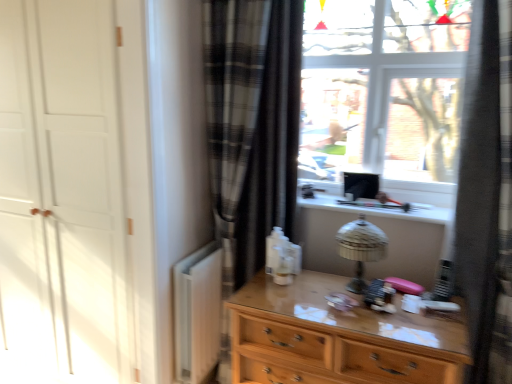
Question: From the image's perspective, is plaid fabric curtain at center on top of wooden chest of drawers at center?

Choices:
 (A) no
 (B) yes

Answer: (B)

Question: Does plaid fabric curtain at center have a lesser width compared to wooden chest of drawers at center?

Choices:
 (A) no
 (B) yes

Answer: (B)

Question: Is plaid fabric curtain at center smaller than wooden chest of drawers at center?

Choices:
 (A) no
 (B) yes

Answer: (B)

Question: From the image's perspective, would you say plaid fabric curtain at center is shown under wooden chest of drawers at center?

Choices:
 (A) no
 (B) yes

Answer: (A)

Question: Does plaid fabric curtain at center contain wooden chest of drawers at center?

Choices:
 (A) no
 (B) yes

Answer: (A)

Question: Can you confirm if plaid fabric curtain at center is taller than wooden chest of drawers at center?

Choices:
 (A) yes
 (B) no

Answer: (A)

Question: Considering the relative sizes of metallic silver table lamp at center and wooden chest of drawers at center in the image provided, is metallic silver table lamp at center bigger than wooden chest of drawers at center?

Choices:
 (A) no
 (B) yes

Answer: (A)

Question: Can wooden chest of drawers at center be found inside metallic silver table lamp at center?

Choices:
 (A) yes
 (B) no

Answer: (B)

Question: Is metallic silver table lamp at center not near wooden chest of drawers at center?

Choices:
 (A) no
 (B) yes

Answer: (A)

Question: From the image's perspective, is metallic silver table lamp at center located beneath wooden chest of drawers at center?

Choices:
 (A) yes
 (B) no

Answer: (B)

Question: Is metallic silver table lamp at center turned away from wooden chest of drawers at center?

Choices:
 (A) yes
 (B) no

Answer: (B)

Question: From the image's perspective, is metallic silver table lamp at center above wooden chest of drawers at center?

Choices:
 (A) yes
 (B) no

Answer: (A)

Question: From the image's perspective, is metallic silver table lamp at center over black plaid curtain at right?

Choices:
 (A) yes
 (B) no

Answer: (B)